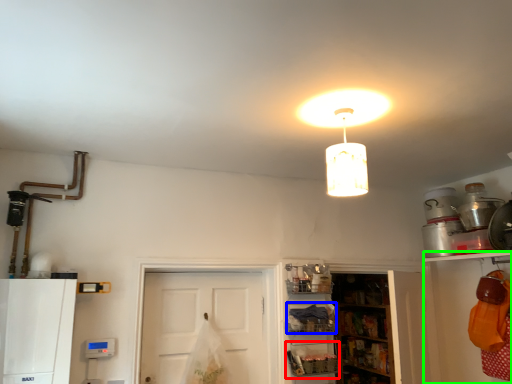
Question: Which object is the farthest from shelf (highlighted by a red box)? Choose among these: shelf (highlighted by a blue box) or shelf (highlighted by a green box).

Choices:
 (A) shelf
 (B) shelf

Answer: (B)